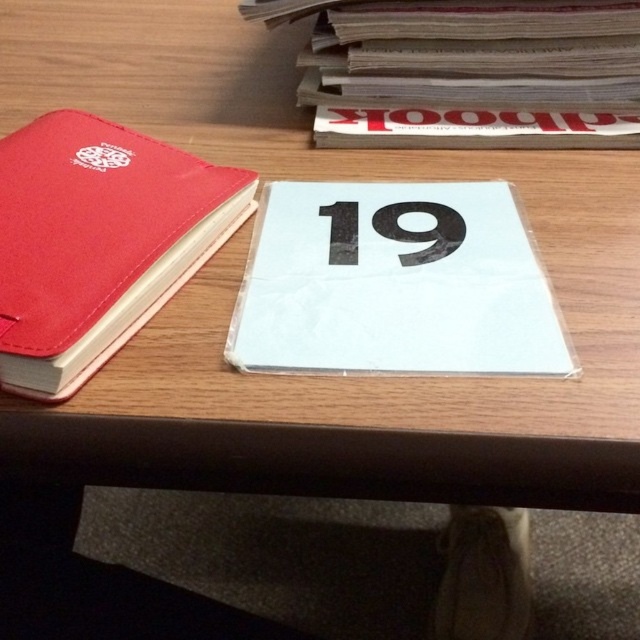
You are organizing items on a table and need to place the matte red notebook at left and the gray paper book at upper right into a box. The box can only fit items that are smaller than 12 inches in any dimension. Based on their sizes, can both items fit into the box?

The matte red notebook at left is bigger than the gray paper book at upper right. However, since the exact size of either item is not provided, it is impossible to determine if they fit into the box with certainty.

You are a delivery robot with a 10 inch arm. You need to pick up the matte red notebook at left from the table. Can your arm reach it?

The matte red notebook at left is 12.49 inches away from the viewer, so the robot arm can reach it since it is longer than 10 inches.

Based on the photo, you are organizing items on a table and need to place a new item between the matte red notebook at left and the gray paper book at upper right. What is the minimum width this new item should have to fit snugly between them?

The minimum width should be at least 22.41 centimeters to fit snugly between the matte red notebook at left and the gray paper book at upper right.